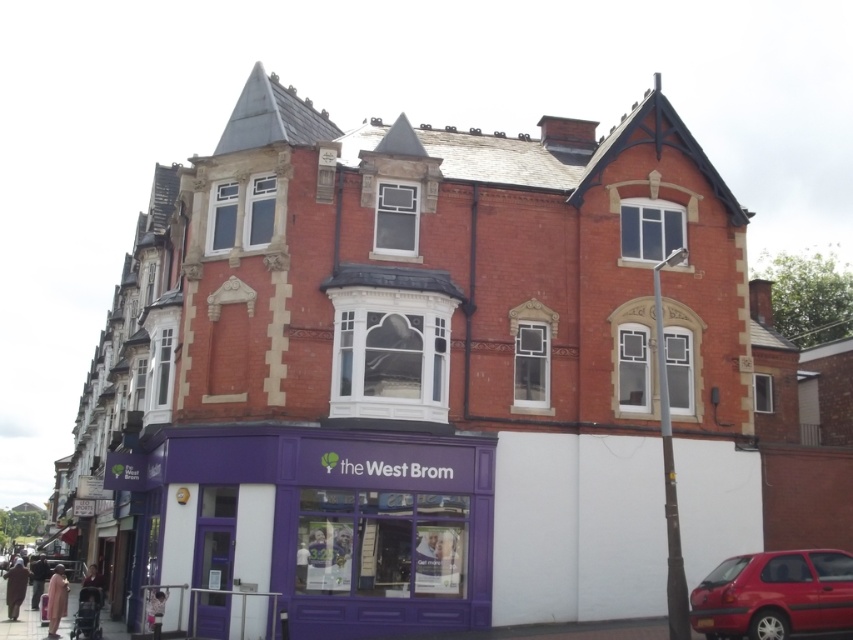
You are a customer arriving at the West Brom building and see the purple matte storefront at lower left and the shiny red car at lower right. Which object is located to the left of the other?

The purple matte storefront at lower left is positioned on the left side of shiny red car at lower right.

You are standing at the entrance of the building and want to walk towards the point marked as point (x=469, y=481). However, there is an obstacle at point (x=730, y=618). Can you reach your destination without going around the obstacle?

Since point (x=469, y=481) is behind point (x=730, y=618), you cannot reach point (x=469, y=481) without going around the obstacle at point (x=730, y=618).

You are a delivery person standing in front of the Victorian building. You need to deliver a package to the purple matte storefront at lower left and the shiny red car at lower right. Which one is taller?

The purple matte storefront at lower left is taller than the shiny red car at lower right.